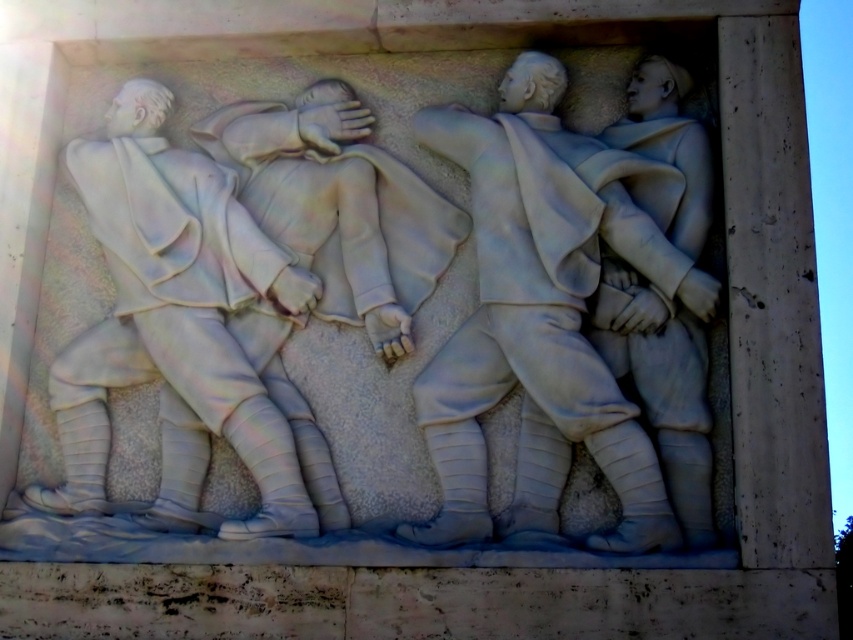
Question: Which point is farther to the camera?

Choices:
 (A) white marble figure at left
 (B) white marble figure at center

Answer: (A)

Question: Can you confirm if white marble figure at center is positioned to the left of white marble figure at left?

Choices:
 (A) yes
 (B) no

Answer: (B)

Question: Observing the image, what is the correct spatial positioning of white marble figure at center in reference to white marble figure at left?

Choices:
 (A) right
 (B) left

Answer: (A)

Question: Considering the relative positions of white marble figure at center and white marble figure at left in the image provided, where is white marble figure at center located with respect to white marble figure at left?

Choices:
 (A) below
 (B) above

Answer: (B)

Question: Among these objects, which one is farthest from the camera?

Choices:
 (A) white marble figure at left
 (B) white marble figure at center

Answer: (A)